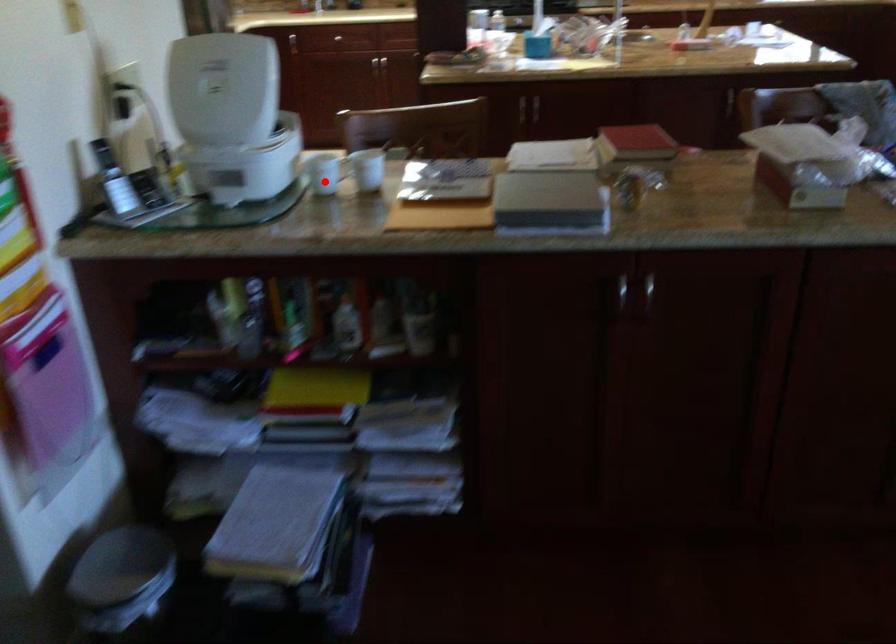
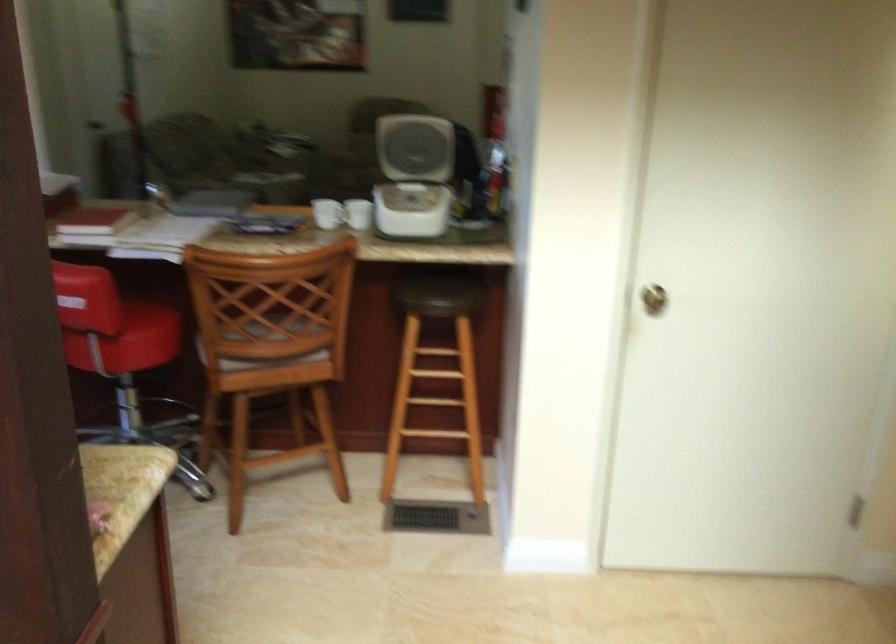
Question: I am providing you with two images of the same scene from different viewpoints. Given a red point in image1, look at the same physical point in image2. Is it:

Choices:
 (A) Closer to the viewpoint
 (B) Farther from the viewpoint

Answer: (B)